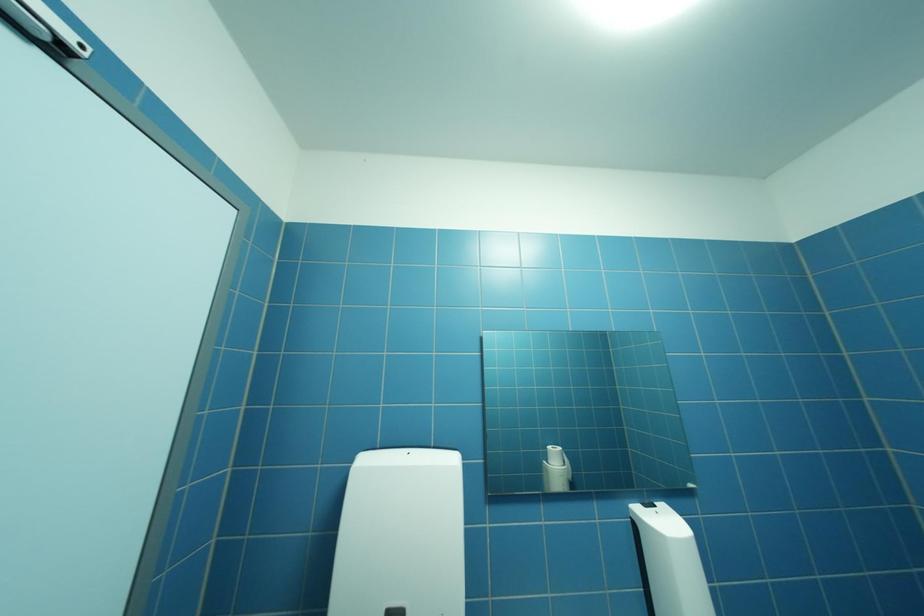
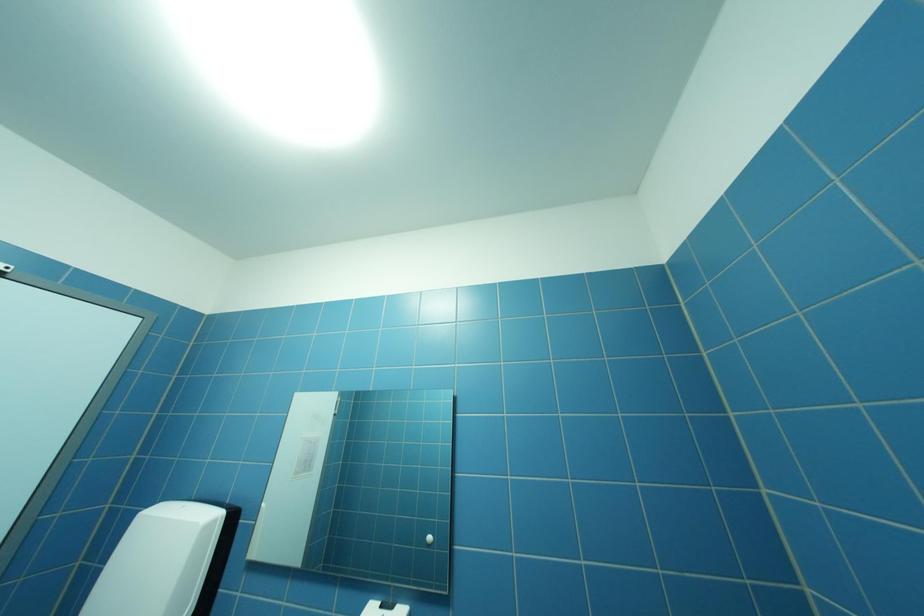
Question: The first image is from the beginning of the video and the second image is from the end. How did the camera likely rotate when shooting the video?

Choices:
 (A) Left
 (B) Right
 (C) Up
 (D) Down

Answer: (A)